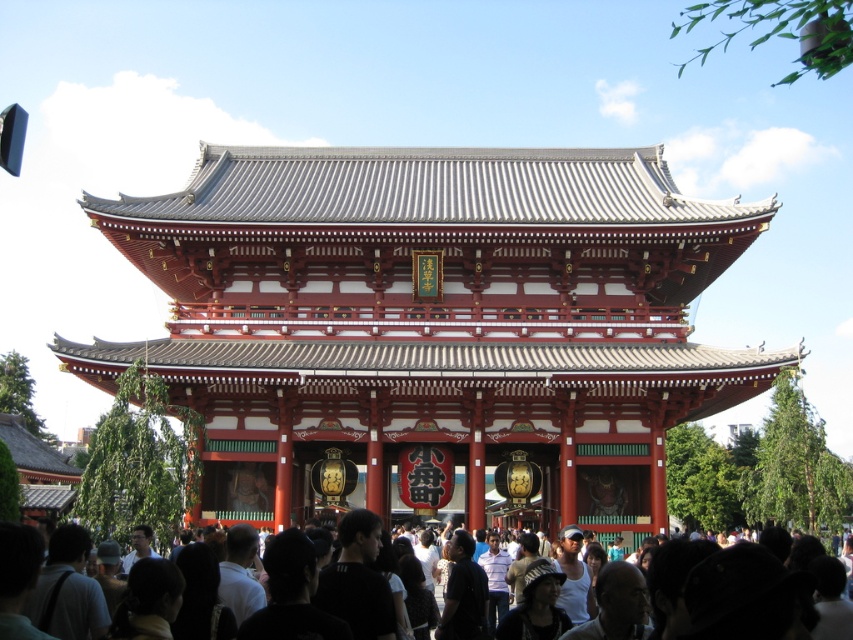
Can you confirm if red lacquered wood gate at center is taller than dark brown hair at lower center?

Indeed, red lacquered wood gate at center has a greater height compared to dark brown hair at lower center.

Is red lacquered wood gate at center above dark brown hair at lower center?

Correct, red lacquered wood gate at center is located above dark brown hair at lower center.

Where is `red lacquered wood gate at center`? The height and width of the screenshot is (640, 853). red lacquered wood gate at center is located at coordinates 433,320.